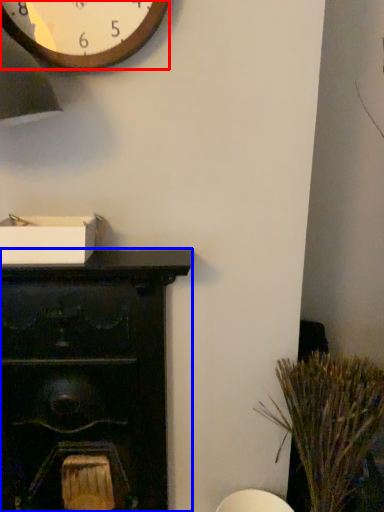
Question: Which point is further to the camera, wall clock (highlighted by a red box) or furniture (highlighted by a blue box)?

Choices:
 (A) wall clock
 (B) furniture

Answer: (B)